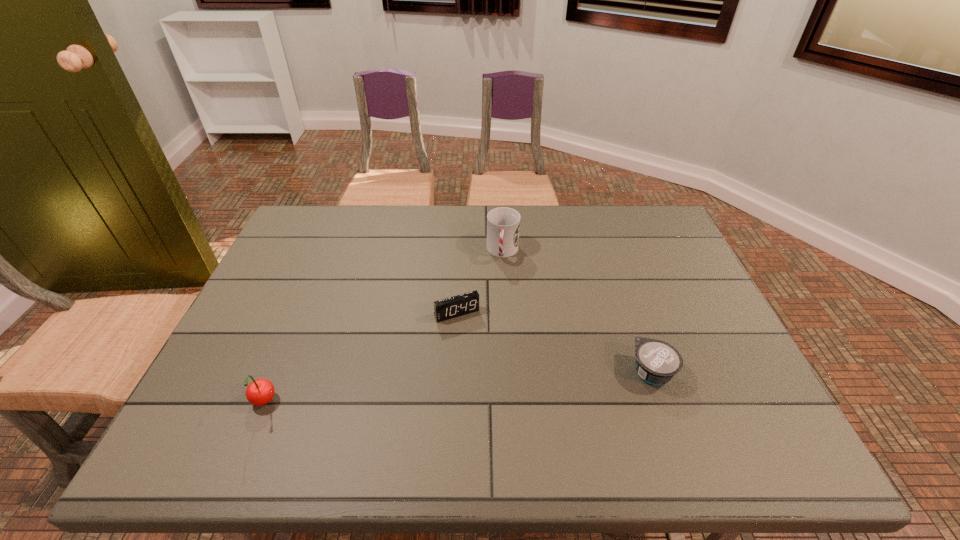
Locate an element on the screen. This screenshot has height=540, width=960. free space that satisfies the following two spatial constraints: 1. on the back side of the second object from right to left; 2. on the right side of the alarm clock is located at coordinates (460, 252).

Locate an element on the screen. This screenshot has height=540, width=960. free spot that satisfies the following two spatial constraints: 1. on the front side of the yogurt; 2. on the right side of the farthest object is located at coordinates (510, 372).